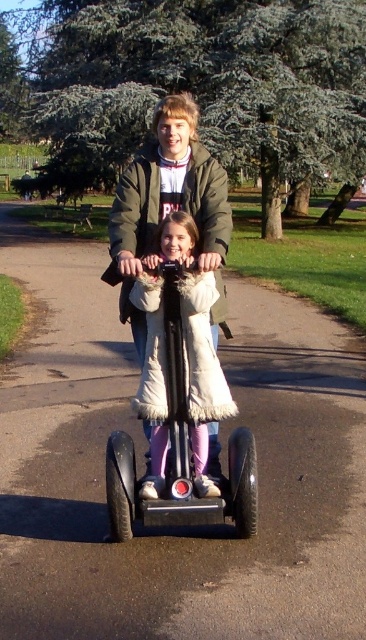
Who is positioned more to the left, black rubber segway at center or matte green jacket at center?

matte green jacket at center

Can you confirm if black rubber segway at center is bigger than matte green jacket at center?

No.

Is point (326, 433) farther from camera compared to point (161, 140)?

Yes, it is behind point (161, 140).

Locate an element on the screen. Image resolution: width=366 pixels, height=640 pixels. black rubber segway at center is located at coordinates (143, 451).

Is black rubber segway at center to the right of metallic silver scooter at center from the viewer's perspective?

No, black rubber segway at center is not to the right of metallic silver scooter at center.

Measure the distance between point (106,300) and camera.

41.06 feet

At what (x,y) coordinates should I click in order to perform the action: click on black rubber segway at center. Please return your answer as a coordinate pair (x, y). The image size is (366, 640). Looking at the image, I should click on (143, 451).

Does matte green jacket at center appear on the left side of metallic silver scooter at center?

Correct, you'll find matte green jacket at center to the left of metallic silver scooter at center.

Which is in front, point (110, 276) or point (117, 474)?

Positioned in front is point (117, 474).

Where is `matte green jacket at center`? This screenshot has width=366, height=640. matte green jacket at center is located at coordinates (166, 204).